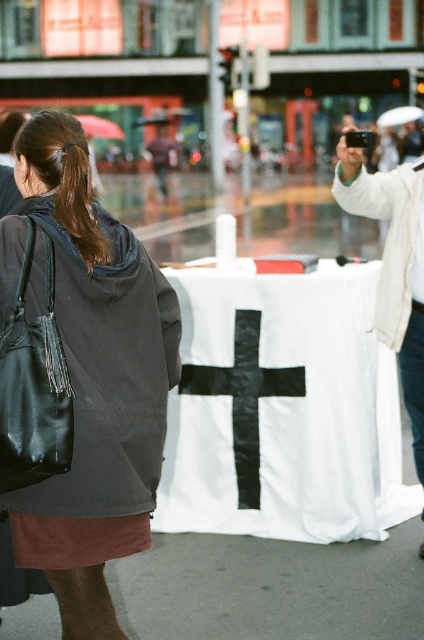
You are a delivery person who needs to place a small package between the black leather jacket at left and the white matte phone at upper right. Can you fit the package in the space between them?

The distance between the black leather jacket at left and the white matte phone at upper right is 1.66 meters, so yes, the package can be placed between them as the space is sufficient.

You are a fashion designer observing the street scene. You need to determine which item is wider between the black leather jacket at left and the brown shiny hair at left. Which one is wider?

The black leather jacket at left is wider than the brown shiny hair at left according to the description.

You are a photographer trying to capture the black leather jacket at left in the frame. The camera you are using has a focal length of 50mm. If the black leather jacket at left is located at coordinates point (89, 374), can you estimate its position relative to the center of the image?

The point (89, 374) indicates the black leather jacket at left is located 58.6 percent from the left edge and 21.2 percent from the top edge of the image, placing it slightly to the left and lower than the center.